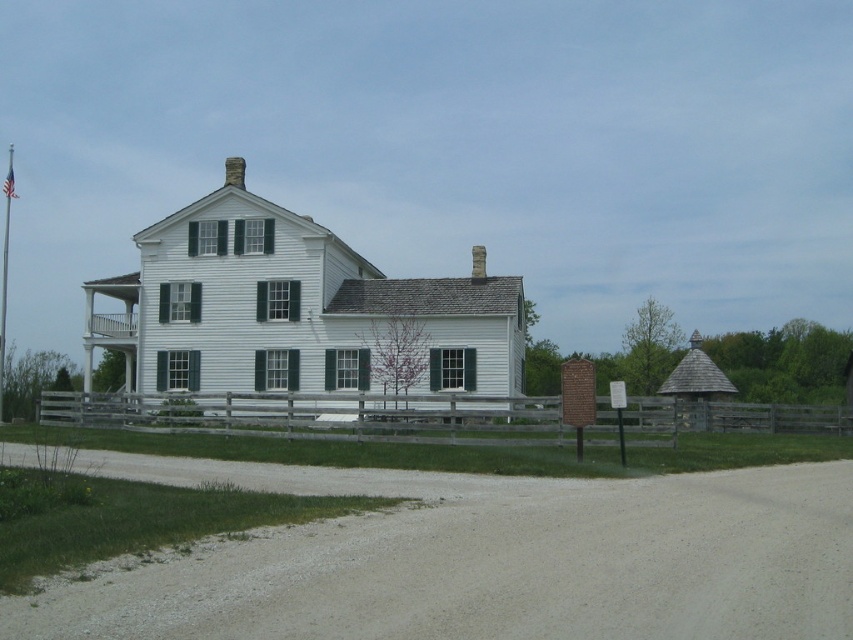
Does point (285, 612) come farther from viewer compared to point (88, 413)?

That is False.

Consider the image. Who is lower down, gray gravel dirt track at lower center or wooden at center?

wooden at center is below.

Which is in front, point (462, 509) or point (281, 433)?

Point (462, 509) is in front.

You are a GUI agent. You are given a task and a screenshot of the screen. Output one action in this format:
    pyautogui.click(x=<x>, y=<y>)
    Task: Click on the gray gravel dirt track at lower center
    This screenshot has height=640, width=853.
    Given the screenshot: What is the action you would take?
    pyautogui.click(x=482, y=561)